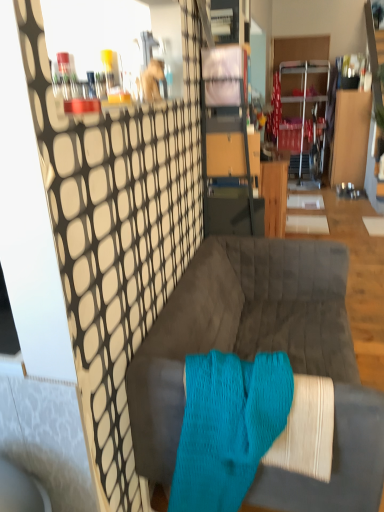
Question: From the image's perspective, is velvet gray couch at center above or below aqua knitted sock at center?

Choices:
 (A) above
 (B) below

Answer: (A)

Question: Does point (349, 411) appear closer or farther from the camera than point (228, 366)?

Choices:
 (A) closer
 (B) farther

Answer: (A)

Question: Which object is the farthest from the aqua knitted sock at center?

Choices:
 (A) velvet gray couch at center
 (B) wooden table at center

Answer: (B)

Question: Which object is positioned farthest from the wooden table at center?

Choices:
 (A) aqua knitted sock at center
 (B) velvet gray couch at center

Answer: (A)